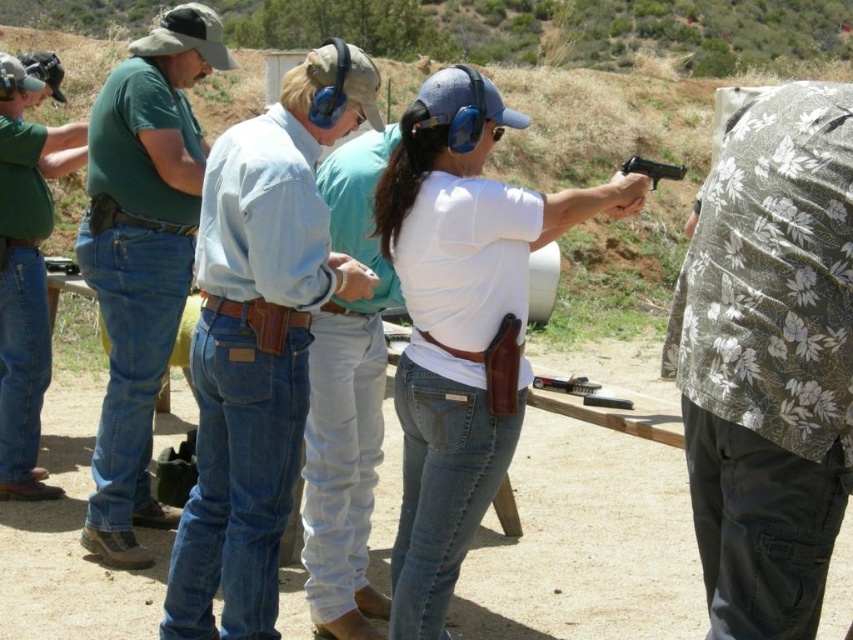
You are a photographer taking a picture of the group at the shooting range. You notice the white matte shirt at center and the brushed metal water at left. Which object should you adjust to ensure both are fully visible in the frame?

The white matte shirt at center is shorter than the brushed metal water at left, so you should lower the camera angle to include the entire height of the white matte shirt at center without cropping it.

You are a photographer positioned at the edge of the shooting range. You want to capture a photo of the white matte shirt at center and the brushed metal water at left. Based on their positions, which object is closer to the camera?

The white matte shirt at center is to the right of the brushed metal water at left, so the brushed metal water at left is closer to the camera.